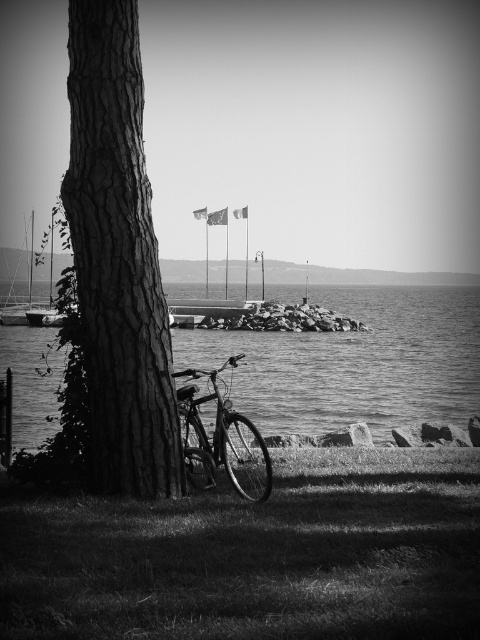
Can you confirm if dark gray bark tree trunk at left is positioned below smooth water at center?

Correct, dark gray bark tree trunk at left is located below smooth water at center.

Does point (126, 28) come farther from viewer compared to point (47, 381)?

No, (126, 28) is closer to viewer.

In order to click on dark gray bark tree trunk at left in this screenshot , I will do `click(118, 259)`.

Where is `dark gray bark tree trunk at left`? dark gray bark tree trunk at left is located at coordinates (118, 259).

Does point (262, 524) come closer to viewer compared to point (19, 307)?

Yes, point (262, 524) is closer to viewer.

At what (x,y) coordinates should I click in order to perform the action: click on grassy lawn at lower left. Please return your answer as a coordinate pair (x, y). This screenshot has height=640, width=480. Looking at the image, I should click on (256, 556).

Does smooth water at center appear under metallic sailboat at left?

Correct, smooth water at center is located below metallic sailboat at left.

Is smooth water at center thinner than metallic sailboat at left?

No, smooth water at center is not thinner than metallic sailboat at left.

Is point (311, 385) less distant than point (10, 323)?

That is True.

Find the location of `smooth water at center`. smooth water at center is located at coordinates (356, 362).